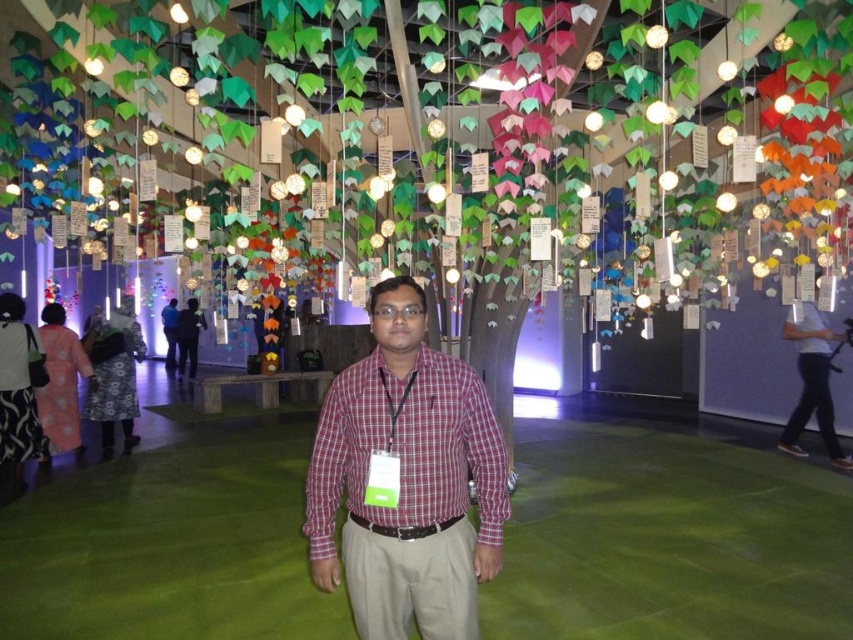
You are standing at the point marked as point [314,444] in this gallery. There is another point 2.33 meters away from you. If you walk straight towards that point, will you be able to reach it without encountering any obstacles? Please explain your reasoning based on the scene description.

The scene description mentions an indoor gallery with an elaborate ceiling installation of colorful paper leaves, origami, and small lights, but there is no mention of any floor obstacles between the two points. The floor is covered with a green carpet, which does not block movement. Therefore, you should be able to walk straight to the other point without encountering obstacles.